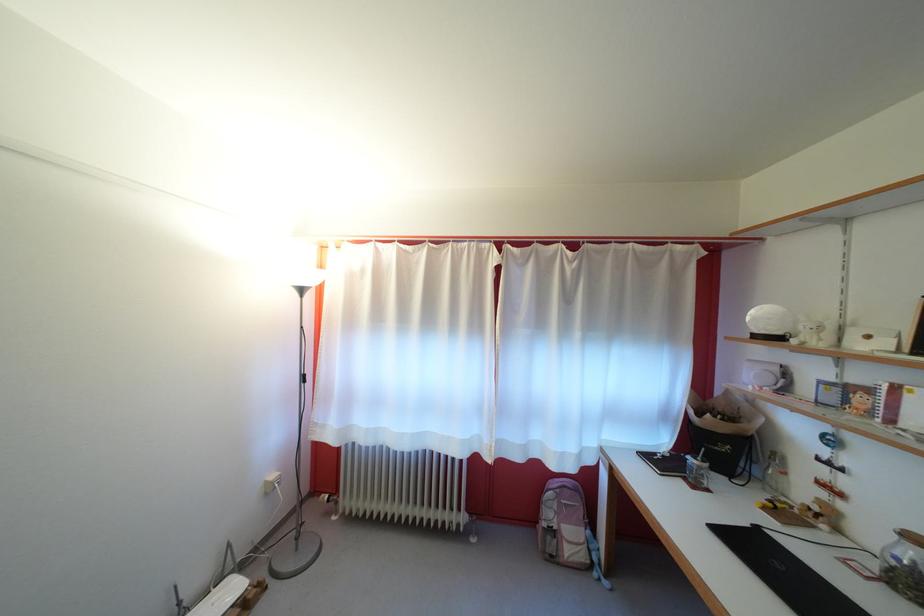
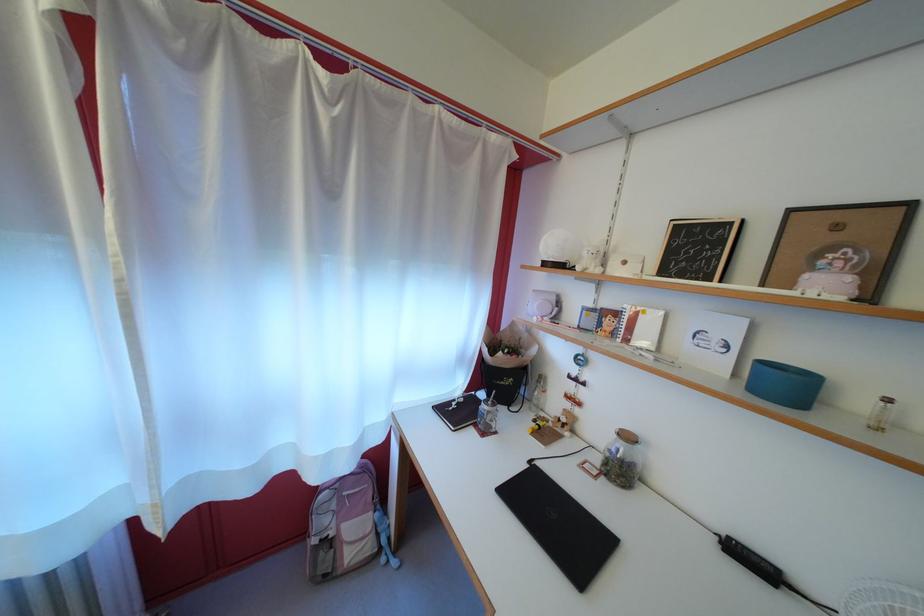
In the second image, find the point that corresponds to the point at 694,485 in the first image.

(483, 431)